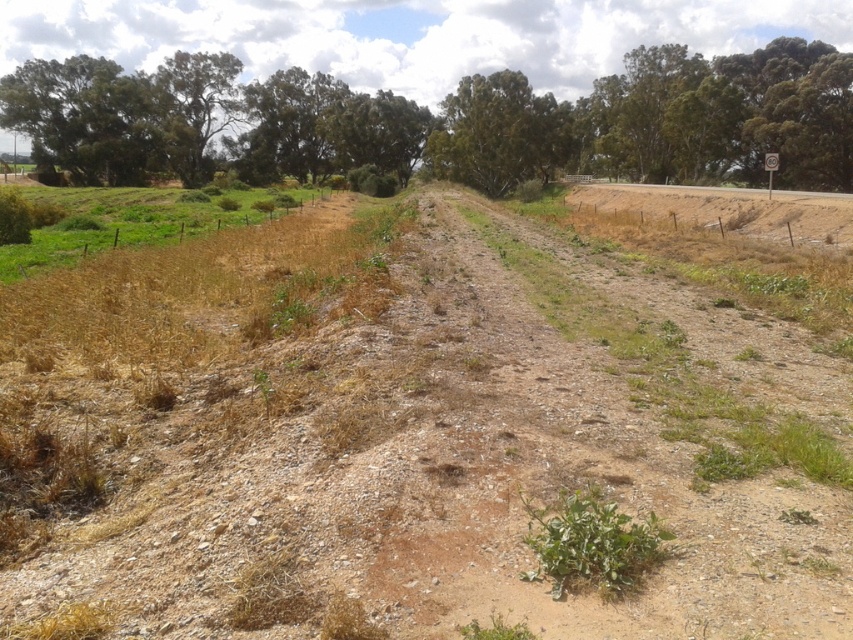
You are a gardener who needs to determine which area is more suitable for planting new flowers. Based on the scene, which object has a wider area for planting? Please refer to the dried grass at center and the green leafy tree at center.

The green leafy tree at center has a wider area compared to the dried grass at center, making it more suitable for planting new flowers.

You are standing at the starting point of the dirt path and want to place a small marker exactly at the dried grass at center. What are the coordinates where you should place the marker?

The dried grass at center is located at coordinates point [407,436], so you should place the marker there.

You are standing at the point marked by the coordinates point (407,436). Looking around, you see the fenced area with greenery on the left side of the path and the forested background behind you. Which direction should you walk to reach the fence with greenery?

You should walk to the left side of the path to reach the fence with greenery, as the fenced area with greenery is located on the left side of the path according to the scene description.